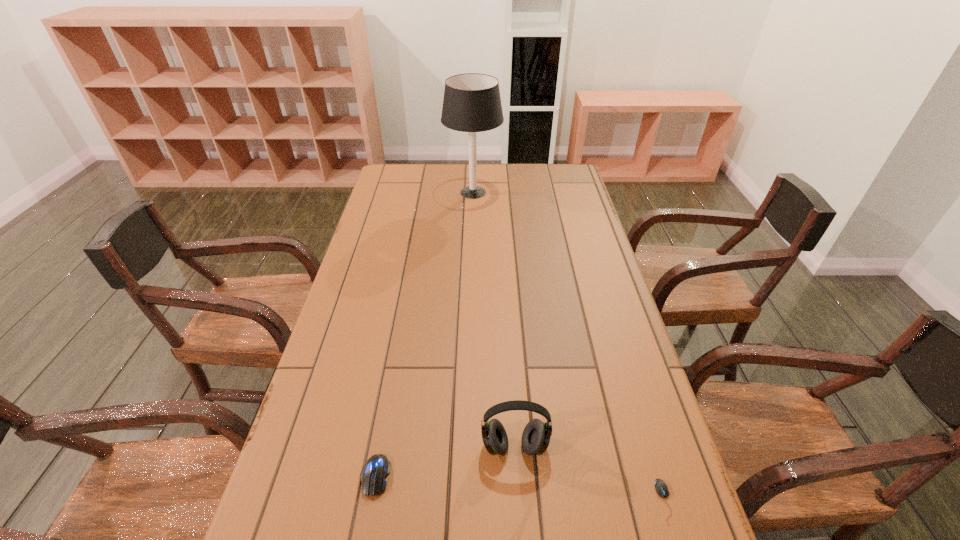
Where is `free space between the table lamp and the rightmost object`? free space between the table lamp and the rightmost object is located at coordinates (569, 347).

Locate an element on the screen. This screenshot has width=960, height=540. free space that is in between the second shortest object and the tallest object is located at coordinates (424, 334).

I want to click on free space between the table lamp and the second tallest object, so point(493,319).

Find the location of a particular element. Image resolution: width=960 pixels, height=540 pixels. vacant area that lies between the third shortest object and the rightmost object is located at coordinates (589, 474).

I want to click on free spot between the right mouse and the leftmost object, so click(x=520, y=488).

Find the location of a particular element. The image size is (960, 540). free area in between the tallest object and the shortest object is located at coordinates (569, 347).

This screenshot has height=540, width=960. Find the location of `empty location between the taller mouse and the headset`. empty location between the taller mouse and the headset is located at coordinates (444, 461).

Where is `unoccupied area between the shortest object and the third shortest object`? unoccupied area between the shortest object and the third shortest object is located at coordinates (589, 474).

Identify which object is the second closest to the third shortest object. Please provide its 2D coordinates. Your answer should be formatted as a tuple, i.e. [(x, y)], where the tuple contains the x and y coordinates of a point satisfying the conditions above.

[(661, 488)]

The image size is (960, 540). What are the coordinates of `object that is the second closest to the farthest object` in the screenshot? It's located at (374, 472).